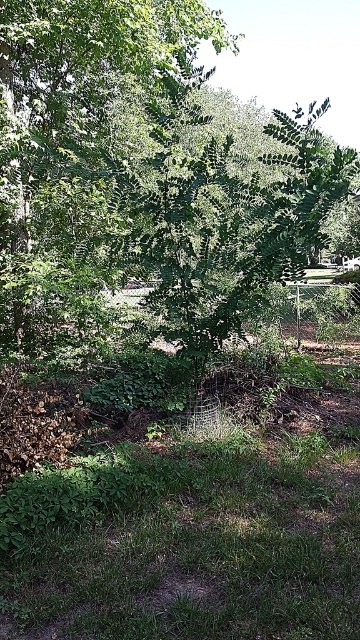
What are the coordinates of the green leafy tree at center in the image?

The green leafy tree at center is located at coordinates (119, 172).